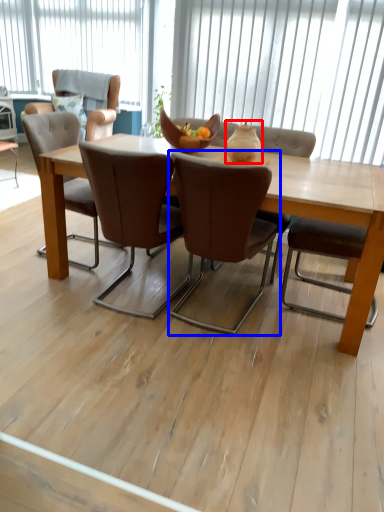
Question: Which of the following is the farthest to the observer, vase (highlighted by a red box) or chair (highlighted by a blue box)?

Choices:
 (A) vase
 (B) chair

Answer: (A)